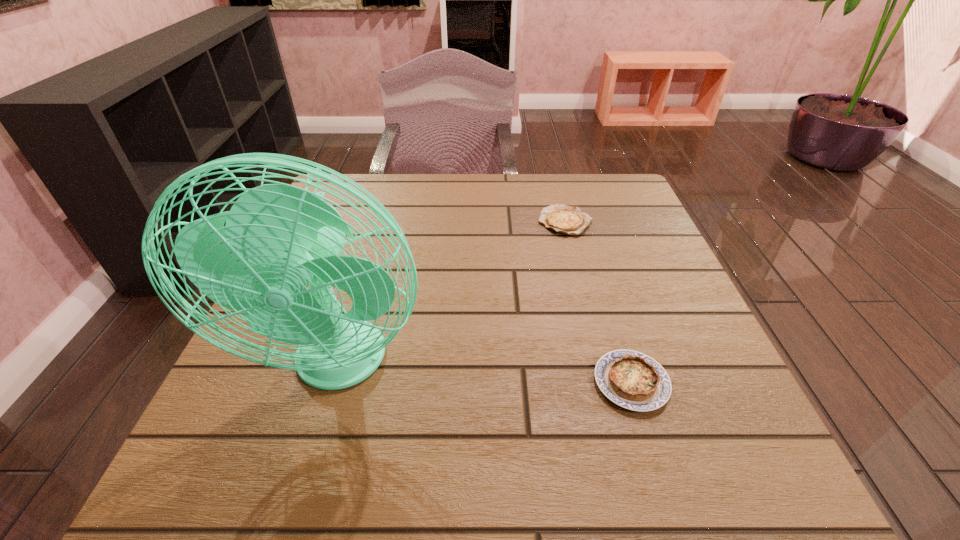
Locate an element on the screen. free space between the shorter quiche and the tallest object is located at coordinates (452, 293).

Find the location of a particular element. The height and width of the screenshot is (540, 960). unoccupied area between the shortest object and the nearer quiche is located at coordinates (598, 302).

The image size is (960, 540). Identify the location of vacant region between the tallest object and the taller quiche. (485, 374).

The image size is (960, 540). Identify the location of free point between the nearer quiche and the farther quiche. (598, 302).

Find the location of a particular element. This screenshot has height=540, width=960. empty location between the taller quiche and the shorter quiche is located at coordinates (598, 302).

Image resolution: width=960 pixels, height=540 pixels. Find the location of `free spot between the nearer quiche and the tallest object`. free spot between the nearer quiche and the tallest object is located at coordinates (485, 374).

You are a GUI agent. You are given a task and a screenshot of the screen. Output one action in this format:
    pyautogui.click(x=<x>, y=<y>)
    Task: Click on the vacant point located between the leftmost object and the shorter quiche
    
    Given the screenshot: What is the action you would take?
    pyautogui.click(x=452, y=293)

You are a GUI agent. You are given a task and a screenshot of the screen. Output one action in this format:
    pyautogui.click(x=<x>, y=<y>)
    Task: Click on the free space between the leftmost object and the shortest object
    
    Given the screenshot: What is the action you would take?
    pyautogui.click(x=452, y=293)

Where is `unoccupied position between the shortest object and the taller quiche`? The height and width of the screenshot is (540, 960). unoccupied position between the shortest object and the taller quiche is located at coordinates (598, 302).

The height and width of the screenshot is (540, 960). In order to click on object that is the closest to the farthest object in this screenshot , I will do 632,380.